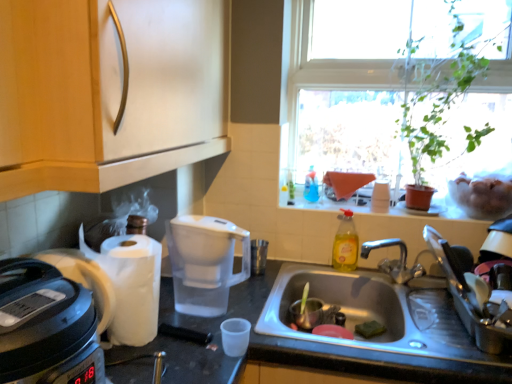
What are the coordinates of `spots to the right of yellow translucent bottle at sink, the 1th bottle positioned from the right` in the screenshot? It's located at (391, 275).